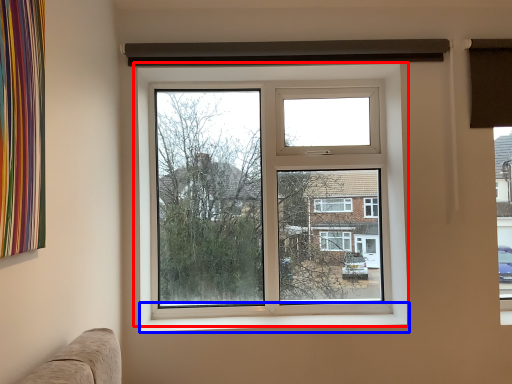
Question: Which object is closer to the camera taking this photo, window (highlighted by a red box) or window sill (highlighted by a blue box)?

Choices:
 (A) window
 (B) window sill

Answer: (B)